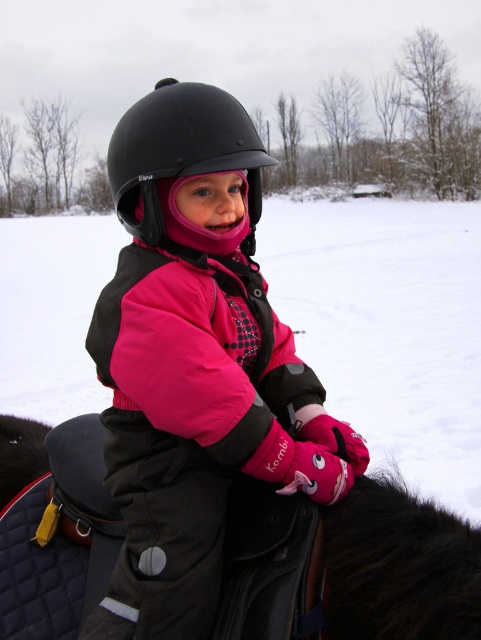
Between pink matte jacket at center and white powdery snow at center, which one has less height?

pink matte jacket at center

Find the location of `pink matte jacket at center`. pink matte jacket at center is located at coordinates (195, 362).

This screenshot has height=640, width=481. What are the coordinates of `pink matte jacket at center` in the screenshot? It's located at (195, 362).

Image resolution: width=481 pixels, height=640 pixels. What do you see at coordinates (195, 362) in the screenshot? I see `pink matte jacket at center` at bounding box center [195, 362].

How distant is pink matte jacket at center from black leather saddle at center?

A distance of 19.34 inches exists between pink matte jacket at center and black leather saddle at center.

Find the location of a particular element. The image size is (481, 640). pink matte jacket at center is located at coordinates (195, 362).

Locate an element on the screen. pink matte jacket at center is located at coordinates (195, 362).

Between white powdery snow at center and black matte helmet at center, which one is positioned lower?

black matte helmet at center is lower down.

This screenshot has width=481, height=640. What do you see at coordinates (389, 326) in the screenshot?
I see `white powdery snow at center` at bounding box center [389, 326].

Image resolution: width=481 pixels, height=640 pixels. What are the coordinates of `white powdery snow at center` in the screenshot? It's located at (389, 326).